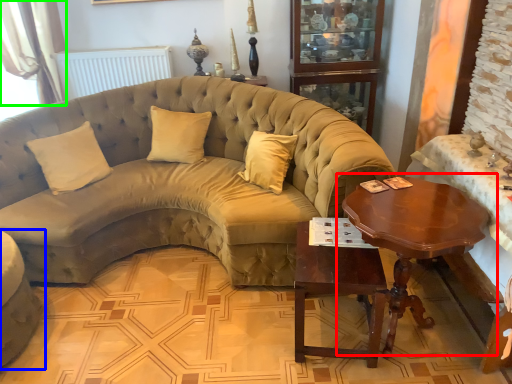
Question: Which object is the farthest from coffee table (highlighted by a red box)? Choose among these: studio couch (highlighted by a blue box) or curtain (highlighted by a green box).

Choices:
 (A) studio couch
 (B) curtain

Answer: (B)